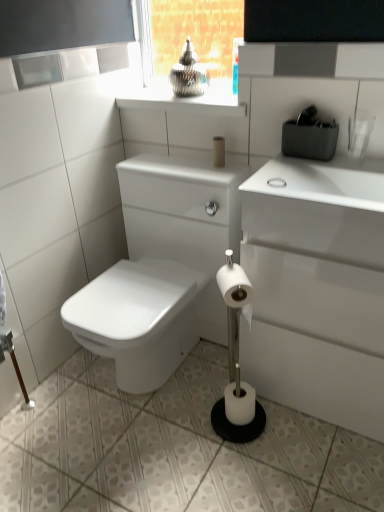
Question: Is white matte toilet paper at center, the 2th toilet paper from the bottom, a part of white matte toilet paper at center, which is the second toilet paper in front-to-back order?

Choices:
 (A) no
 (B) yes

Answer: (A)

Question: Is white matte toilet paper at center, acting as the 3th toilet paper starting from the top, outside of white matte toilet paper at center, the 2th toilet paper from the bottom?

Choices:
 (A) no
 (B) yes

Answer: (B)

Question: Could you tell me if white matte toilet paper at center, the 1th toilet paper when ordered from bottom to top, is turned towards white matte toilet paper at center, positioned as the 2th toilet paper in top-to-bottom order?

Choices:
 (A) yes
 (B) no

Answer: (B)

Question: From a real-world perspective, is white matte toilet paper at center, the 1th toilet paper when ordered from bottom to top, beneath white matte toilet paper at center, the 2th toilet paper from the bottom?

Choices:
 (A) yes
 (B) no

Answer: (A)

Question: From the image's perspective, is white matte toilet paper at center, which is the second toilet paper in front-to-back order, located above white matte toilet paper at center, the 2th toilet paper from the bottom?

Choices:
 (A) no
 (B) yes

Answer: (A)

Question: In the image, is white matte toilet paper at center, the 2th toilet paper from the bottom, positioned in front of or behind metallic silver at upper center?

Choices:
 (A) behind
 (B) front

Answer: (B)

Question: In terms of size, does white matte toilet paper at center, acting as the 1th toilet paper starting from the front, appear bigger or smaller than metallic silver at upper center?

Choices:
 (A) big
 (B) small

Answer: (B)

Question: Is point click(249, 302) closer or farther from the camera than point click(153, 80)?

Choices:
 (A) closer
 (B) farther

Answer: (A)

Question: Considering the relative positions of white matte toilet paper at center, acting as the 1th toilet paper starting from the front, and metallic silver at upper center in the image provided, is white matte toilet paper at center, acting as the 1th toilet paper starting from the front, to the left or to the right of metallic silver at upper center?

Choices:
 (A) right
 (B) left

Answer: (A)

Question: From the image's perspective, is white matte toilet paper at center, which is the second toilet paper in front-to-back order, located above or below metallic silver at upper center?

Choices:
 (A) above
 (B) below

Answer: (B)

Question: Visually, is white matte toilet paper at center, acting as the 3th toilet paper starting from the top, positioned to the left or to the right of metallic silver at upper center?

Choices:
 (A) right
 (B) left

Answer: (A)

Question: Considering the positions of white matte toilet paper at center, which is the second toilet paper in front-to-back order, and metallic silver at upper center in the image, is white matte toilet paper at center, which is the second toilet paper in front-to-back order, wider or thinner than metallic silver at upper center?

Choices:
 (A) thin
 (B) wide

Answer: (A)

Question: From a real-world perspective, is white matte toilet paper at center, the 1th toilet paper when ordered from bottom to top, physically located above or below metallic silver at upper center?

Choices:
 (A) above
 (B) below

Answer: (B)

Question: Is white matte toilet paper at center, which is the second toilet paper in front-to-back order, spatially inside white matte toilet paper at center, the 3th toilet paper in the back-to-front sequence, or outside of it?

Choices:
 (A) outside
 (B) inside

Answer: (A)

Question: Considering the positions of white matte toilet paper at center, acting as the 3th toilet paper starting from the top, and white matte toilet paper at center, acting as the 1th toilet paper starting from the front, in the image, is white matte toilet paper at center, acting as the 3th toilet paper starting from the top, wider or thinner than white matte toilet paper at center, acting as the 1th toilet paper starting from the front,?

Choices:
 (A) thin
 (B) wide

Answer: (B)